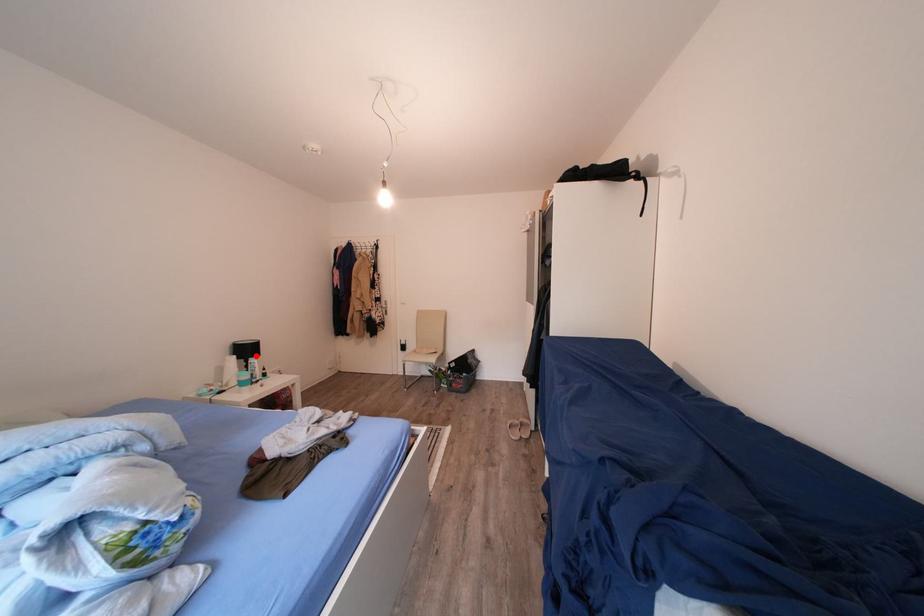
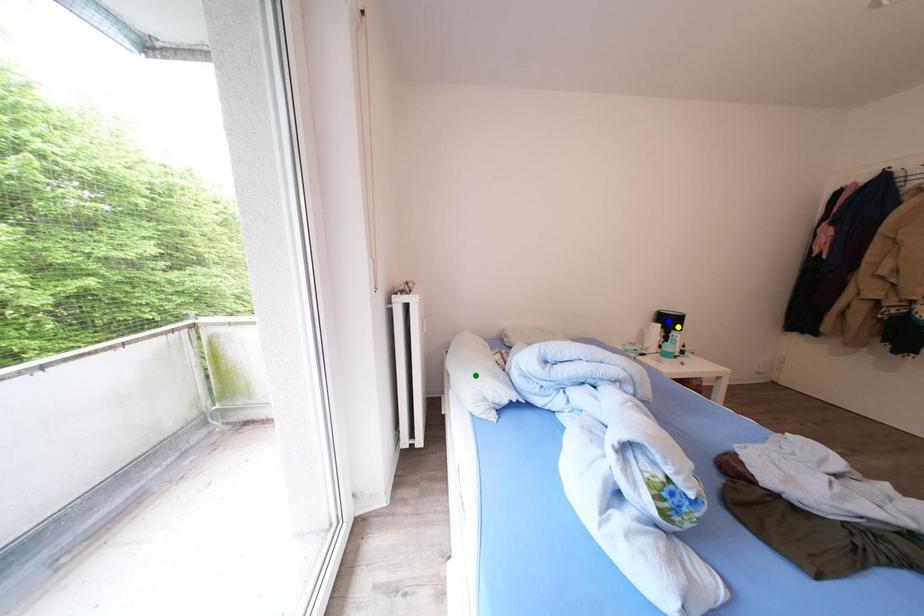
Question: I am providing you with two images of the same scene from different viewpoints. A red point is marked on the first image. You are given multiple points on the second image. Can you choose the point in image 2 that corresponds to the point in image 1?

Choices:
 (A) green point
 (B) blue point
 (C) yellow point

Answer: (C)